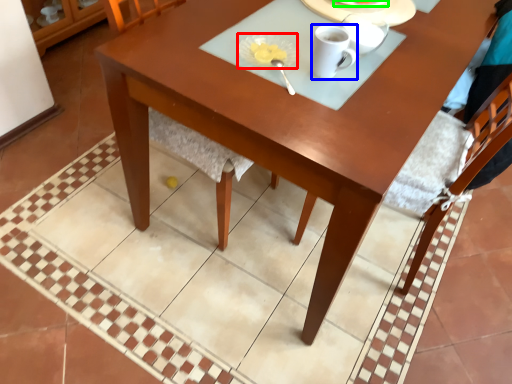
Question: Which object is the closest to the tableware (highlighted by a red box)? Choose among these: coffee cup (highlighted by a blue box) or tableware (highlighted by a green box).

Choices:
 (A) coffee cup
 (B) tableware

Answer: (A)